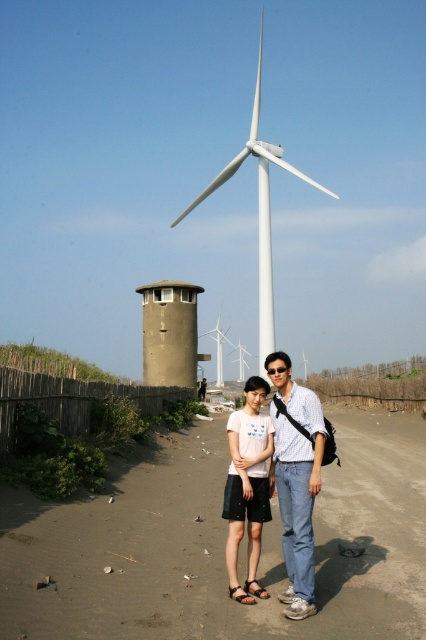
You are a photographer trying to capture both the denim jeans at center and the white matte windmill at center in a single shot. Based on their positions, can you tell which object is closer to the camera?

The denim jeans at center is above the white matte windmill at center, which suggests it is closer to the camera since objects higher in the frame are typically nearer in perspective.